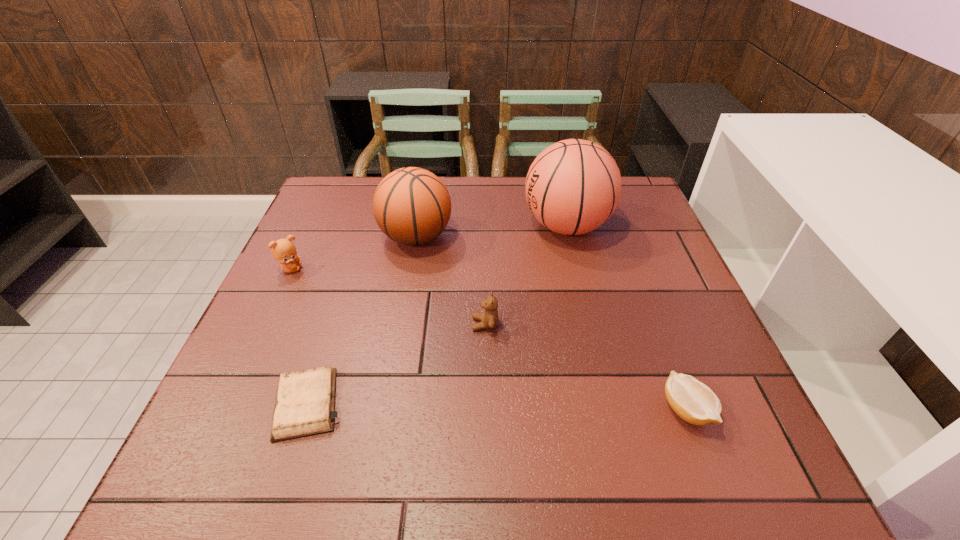
Find the location of a particular element. This screenshot has width=960, height=540. the taller basketball is located at coordinates pos(572,187).

You are a GUI agent. You are given a task and a screenshot of the screen. Output one action in this format:
    pyautogui.click(x=<x>, y=<y>)
    Task: Click on the tallest object
    This screenshot has width=960, height=540.
    Given the screenshot: What is the action you would take?
    pyautogui.click(x=572, y=187)

You are a GUI agent. You are given a task and a screenshot of the screen. Output one action in this format:
    pyautogui.click(x=<x>, y=<y>)
    Task: Click on the left basketball
    Image resolution: width=960 pixels, height=540 pixels.
    Given the screenshot: What is the action you would take?
    pyautogui.click(x=412, y=206)

This screenshot has width=960, height=540. I want to click on the shorter basketball, so click(x=412, y=206).

Locate an element on the screen. the leftmost object is located at coordinates (283, 250).

Find the location of a particular element. the farther teddy bear is located at coordinates (283, 250).

Locate an element on the screen. Image resolution: width=960 pixels, height=540 pixels. the nearer teddy bear is located at coordinates (489, 318).

This screenshot has width=960, height=540. Identify the location of the third object from right to left. (489, 318).

The image size is (960, 540). What are the coordinates of `the second shortest object` in the screenshot? It's located at (693, 401).

The height and width of the screenshot is (540, 960). In order to click on diary in this screenshot , I will do `click(305, 400)`.